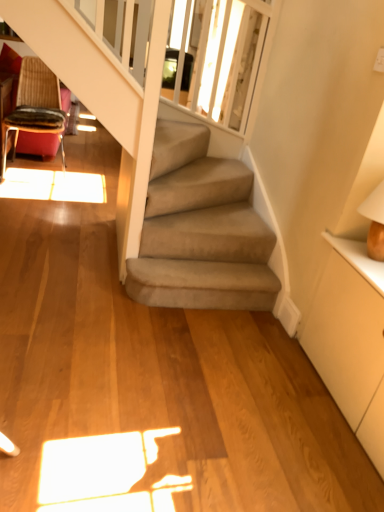
Where is `free point below wooden textured chair at upper left (from a real-world perspective)`? free point below wooden textured chair at upper left (from a real-world perspective) is located at coordinates (49, 169).